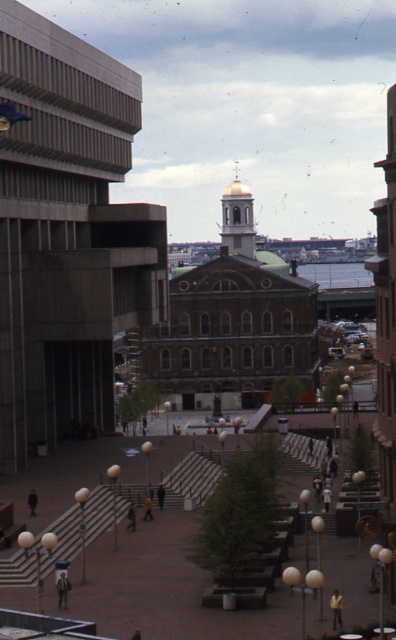
Question: Which point appears closest to the camera in this image?

Choices:
 (A) (91, 362)
 (B) (234, 244)

Answer: (A)

Question: Is concrete building at left above gold dome at center?

Choices:
 (A) yes
 (B) no

Answer: (B)

Question: Which object is farther from the camera taking this photo?

Choices:
 (A) concrete building at left
 (B) gold dome at center

Answer: (B)

Question: Does concrete building at left have a smaller size compared to gold dome at center?

Choices:
 (A) yes
 (B) no

Answer: (B)

Question: Can you confirm if concrete building at left is positioned to the left of gold dome at center?

Choices:
 (A) yes
 (B) no

Answer: (A)